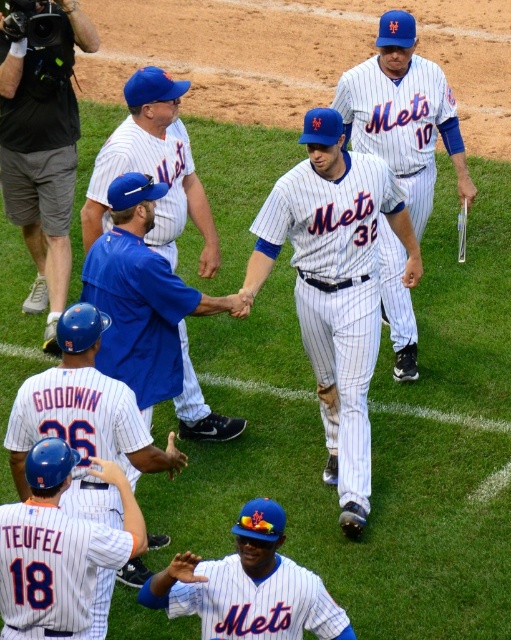
Question: Does blue fabric shirt at center have a greater width compared to matte blue cap at center?

Choices:
 (A) no
 (B) yes

Answer: (A)

Question: Which point appears farthest from the camera in this image?

Choices:
 (A) (445, 113)
 (B) (174, 616)
 (C) (168, 364)
 (D) (303, 292)

Answer: (A)

Question: Does blue matte helmet at upper left appear under white pinstriped uniform at center?

Choices:
 (A) no
 (B) yes

Answer: (A)

Question: Does blue fabric shirt at center have a greater width compared to blue jersey at center?

Choices:
 (A) yes
 (B) no

Answer: (B)

Question: Which of the following is the farthest from the observer?

Choices:
 (A) (127, 230)
 (B) (160, 456)
 (C) (176, 612)
 (D) (299, 285)

Answer: (D)

Question: Which point is closer to the camera?

Choices:
 (A) white pinstriped jersey at lower left
 (B) blue jersey at center
 (C) blue fabric shirt at center
 (D) white pinstriped jersey at center

Answer: (A)